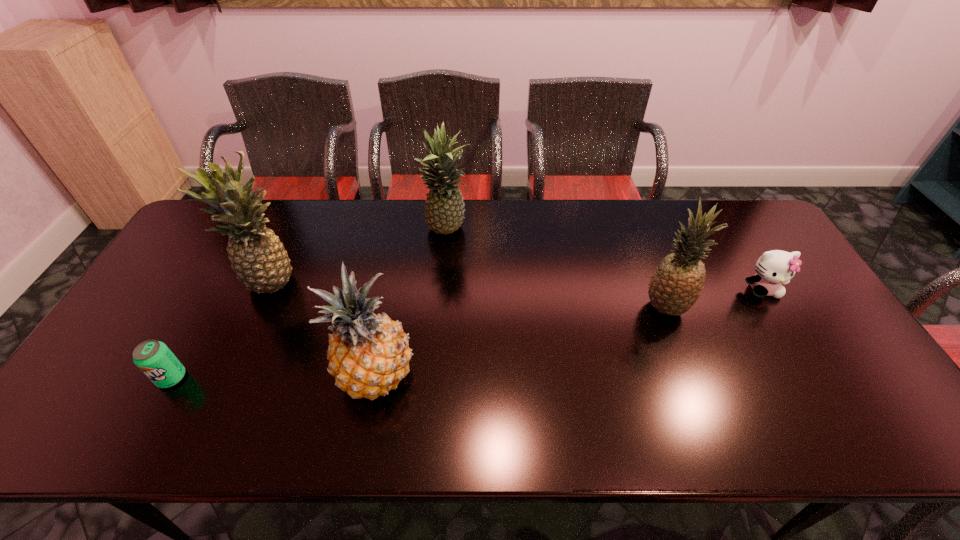
Find the location of a particular element. vacant region at the right edge is located at coordinates (869, 395).

Identify the location of free space between the kitten and the rightmost pineapple. (714, 298).

Image resolution: width=960 pixels, height=540 pixels. In order to click on free space between the rightmost object and the farthest pineapple in this screenshot , I will do `click(605, 260)`.

In order to click on unoccupied position between the second object from left to right and the pop soda in this screenshot , I will do `click(223, 330)`.

This screenshot has height=540, width=960. Identify the location of vacant area that lies between the nearest pineapple and the farthest pineapple. (412, 303).

Locate an element on the screen. The image size is (960, 540). free space between the rightmost pineapple and the nearest pineapple is located at coordinates (520, 342).

Where is `vacant area that lies between the farthest pineapple and the fifth object from left to right`? vacant area that lies between the farthest pineapple and the fifth object from left to right is located at coordinates (557, 269).

This screenshot has width=960, height=540. Identify the location of free space between the shortest object and the fifth object from right to left. (223, 330).

Where is `free spot between the second object from left to right and the kitten`? free spot between the second object from left to right and the kitten is located at coordinates (517, 286).

The height and width of the screenshot is (540, 960). Identify the location of free area in between the nearest pineapple and the second object from left to right. (324, 330).